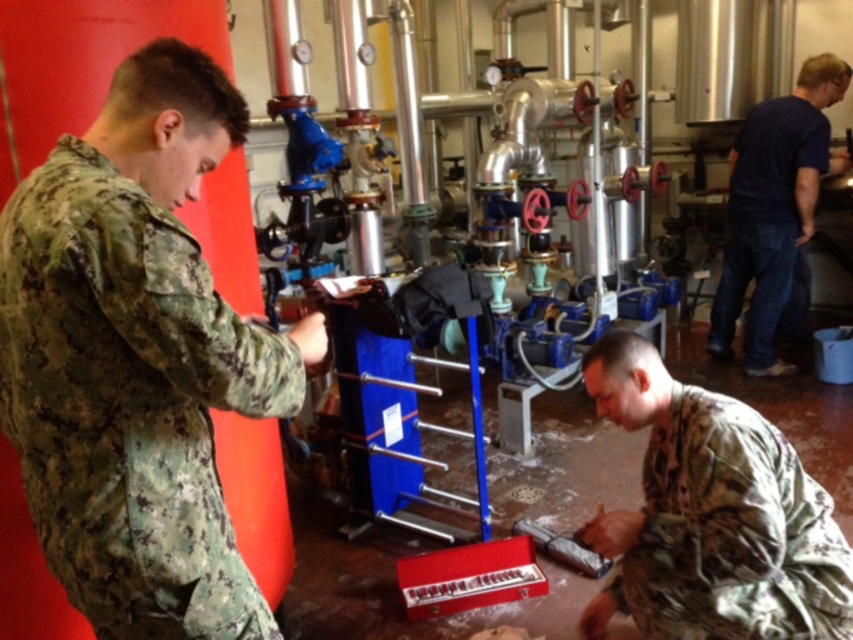
Can you confirm if camouflage fabric uniform at left is bigger than camouflage fabric uniform at lower right?

Yes.

Does point (115, 467) come in front of point (704, 518)?

That is True.

Does point (120, 618) come in front of point (730, 596)?

Yes, it is.

Identify the location of camouflage fabric uniform at left. (137, 358).

Is camouflage fabric uniform at left shorter than dark blue shirt at right?

Indeed, camouflage fabric uniform at left has a lesser height compared to dark blue shirt at right.

Which is behind, point (230, 602) or point (769, 266)?

The point (769, 266) is behind.

Identify the location of camouflage fabric uniform at left. (137, 358).

Who is positioned more to the right, camouflage fabric uniform at lower right or dark blue shirt at right?

dark blue shirt at right

Is camouflage fabric uniform at lower right smaller than dark blue shirt at right?

Yes.

Between point (709, 561) and point (729, 259), which one is positioned behind?

Positioned behind is point (729, 259).

Image resolution: width=853 pixels, height=640 pixels. In order to click on camouflage fabric uniform at lower right in this screenshot , I will do tap(711, 515).